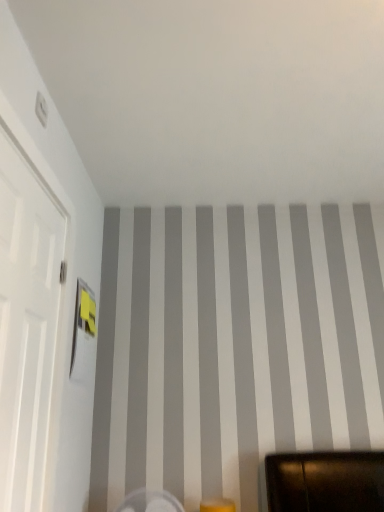
In order to face white glossy door at left, should I rotate leftwards or rightwards?

A 22.588 degree turn to the left will do.

Measure the distance between white glossy door at left and camera.

The depth of white glossy door at left is 3.51 feet.

Locate an element on the screen. white glossy door at left is located at coordinates (26, 324).

Measure the distance between point (21, 315) and camera.

Point (21, 315) and camera are 1.19 meters apart from each other.

What do you see at coordinates (26, 324) in the screenshot? I see `white glossy door at left` at bounding box center [26, 324].

You are a GUI agent. You are given a task and a screenshot of the screen. Output one action in this format:
    pyautogui.click(x=<x>, y=<y>)
    Task: Click on the white glossy door at left
    This screenshot has height=512, width=384.
    Given the screenshot: What is the action you would take?
    pyautogui.click(x=26, y=324)